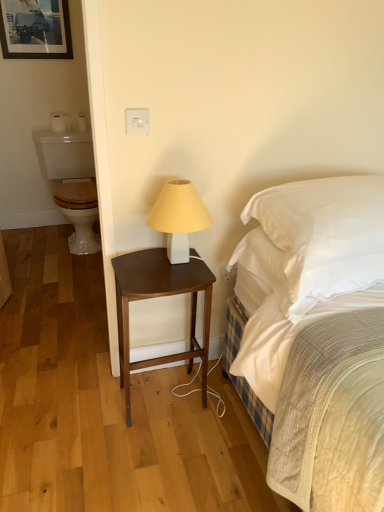
Question: Does point (203, 224) appear closer or farther from the camera than point (279, 240)?

Choices:
 (A) closer
 (B) farther

Answer: (B)

Question: Considering the positions of white matte table lamp at center and white satin pillow at upper right in the image, is white matte table lamp at center wider or thinner than white satin pillow at upper right?

Choices:
 (A) thin
 (B) wide

Answer: (A)

Question: Which of these objects is positioned closest to the white glossy toilet at left?

Choices:
 (A) white satin pillow at upper right
 (B) dark wood nightstand at center
 (C) white matte table lamp at center
 (D) matte black picture frame at upper left
 (E) white plastic electric outlet at lower center

Answer: (D)

Question: Which object is positioned closest to the dark wood nightstand at center?

Choices:
 (A) white satin pillow at upper right
 (B) white matte table lamp at center
 (C) white glossy toilet at left
 (D) white plastic electric outlet at lower center
 (E) matte black picture frame at upper left

Answer: (B)